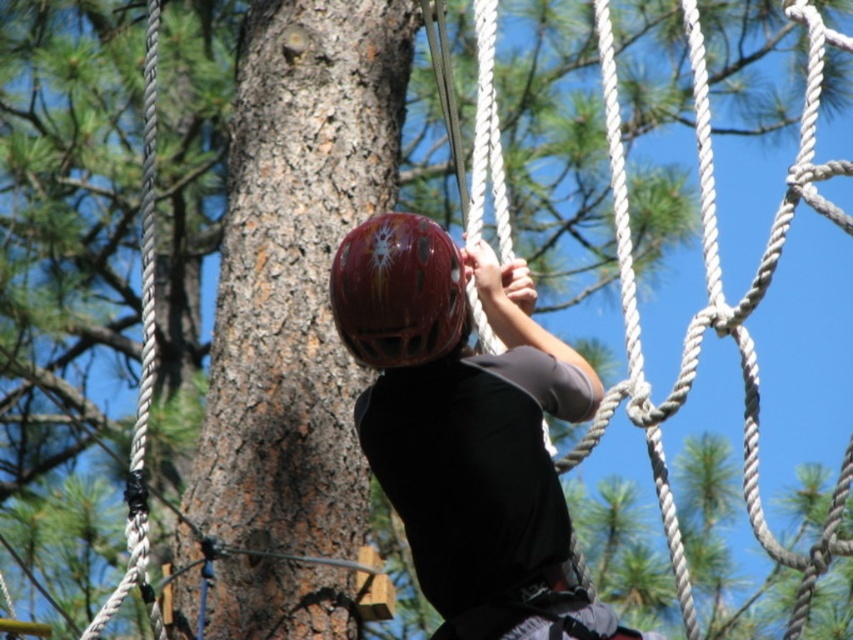
In the scene shown: Does shiny red helmet at center appear under glossy red helmet at center?

Yes.

Who is more distant from viewer, (547, 602) or (380, 355)?

The point (380, 355) is more distant.

What do you see at coordinates (460, 436) in the screenshot? I see `shiny red helmet at center` at bounding box center [460, 436].

Find the location of a particular element. shiny red helmet at center is located at coordinates (460, 436).